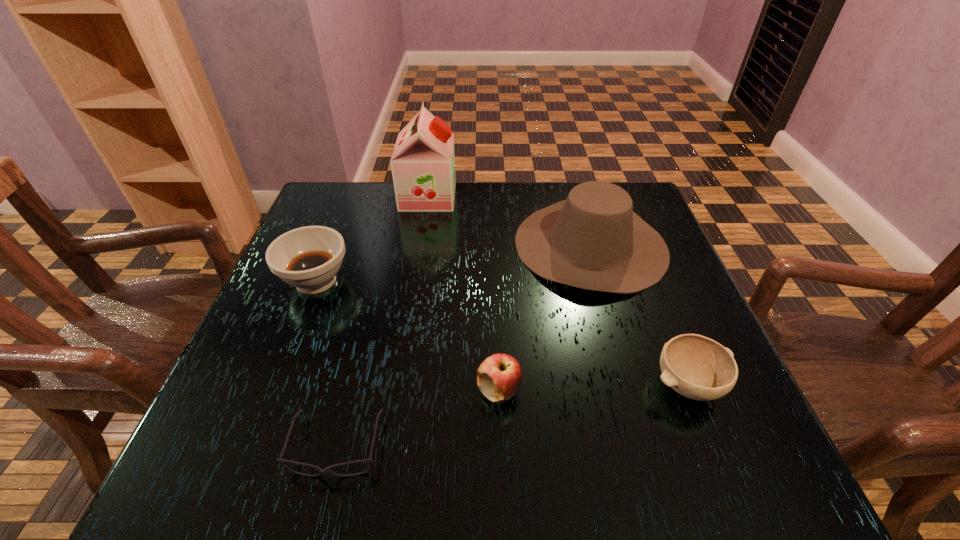
I want to click on vacant area that lies between the nearest object and the fifth shortest object, so click(464, 346).

Where is `vacant area between the second tallest object and the spectacles`? This screenshot has width=960, height=540. vacant area between the second tallest object and the spectacles is located at coordinates (464, 346).

This screenshot has height=540, width=960. Identify the location of free space between the soup bowl and the cowboy hat. (453, 262).

The width and height of the screenshot is (960, 540). In order to click on free spot between the soup bowl and the second tallest object in this screenshot , I will do [453, 262].

Where is `vacant area between the bowl and the soup bowl`? This screenshot has width=960, height=540. vacant area between the bowl and the soup bowl is located at coordinates pos(502,333).

Locate an element on the screen. This screenshot has width=960, height=540. free space between the apple and the soup bowl is located at coordinates (408, 335).

Identify which object is located as the fourth nearest to the cowboy hat. Please provide its 2D coordinates. Your answer should be formatted as a tuple, i.e. [(x, y)], where the tuple contains the x and y coordinates of a point satisfying the conditions above.

[(327, 470)]

Find the location of a particular element. The height and width of the screenshot is (540, 960). the fourth closest object relative to the apple is located at coordinates 308,258.

Locate an element on the screen. The height and width of the screenshot is (540, 960). vacant point that satisfies the following two spatial constraints: 1. with the cap open on the tallest object; 2. on the back side of the second tallest object is located at coordinates (x=420, y=245).

At what (x,y) coordinates should I click in order to perform the action: click on blank space that satisfies the following two spatial constraints: 1. on the back side of the second tallest object; 2. on the left side of the soup bowl. Please return your answer as a coordinate pair (x, y). Looking at the image, I should click on (330, 245).